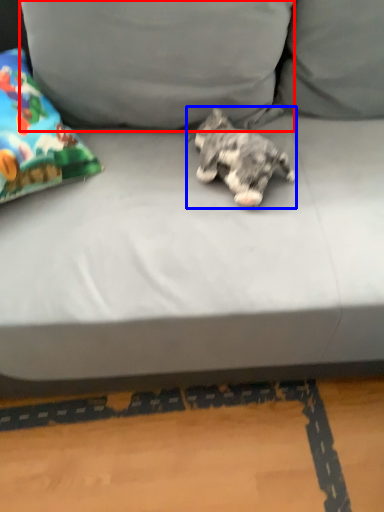
Question: Which object is further to the camera taking this photo, pillow (highlighted by a red box) or dog (highlighted by a blue box)?

Choices:
 (A) pillow
 (B) dog

Answer: (B)